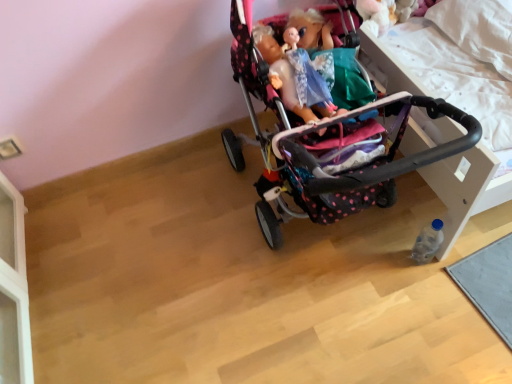
What are the coordinates of `free space in front of polka dot fabric stroller at center` in the screenshot? It's located at (352, 334).